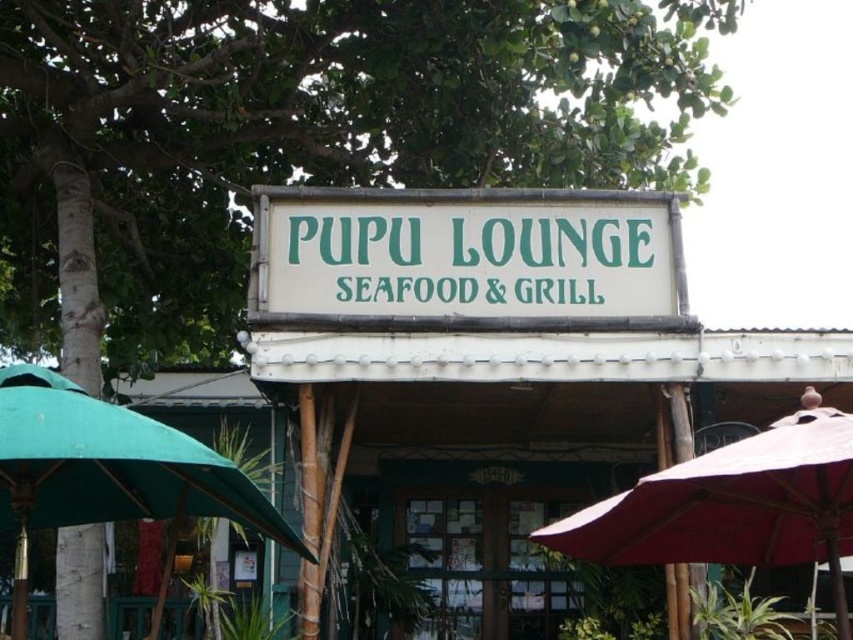
You are standing in front of the Pupu Lounge Seafood and Grill restaurant. You see a point at coordinates (x=467, y=256). What object is located at that point?

The point at coordinates (x=467, y=256) indicates the white bamboo sign at center.

You are a customer approaching the entrance of the Pupu Lounge Seafood and Grill. You see the matte red umbrella at lower right and the green fabric umbrella at left. Which umbrella is closer to the entrance?

The matte red umbrella at lower right is closer to the entrance because the green fabric umbrella at left is behind it.

You are a customer arriving at the Pupu Lounge Seafood and Grill. You see the matte red umbrella at lower right and the green fabric umbrella at left. Which umbrella takes up more space in the scene?

The green fabric umbrella at left occupies more space than the matte red umbrella at lower right.